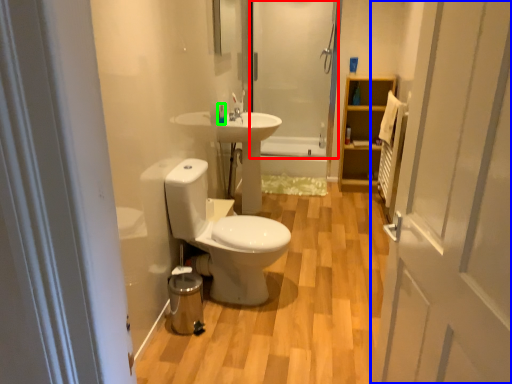
Question: Based on their relative distances, which object is nearer to shower door (highlighted by a red box)? Choose from door (highlighted by a blue box) and toiletry (highlighted by a green box).

Choices:
 (A) door
 (B) toiletry

Answer: (B)